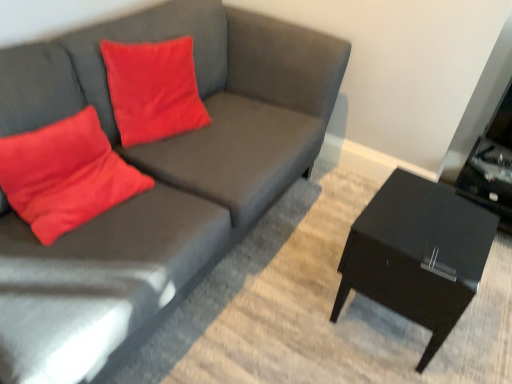
Image resolution: width=512 pixels, height=384 pixels. What do you see at coordinates (65, 175) in the screenshot? I see `matte red pillow at left` at bounding box center [65, 175].

I want to click on black glossy side table at right, so click(417, 254).

Where is `matte gray couch at center`? The image size is (512, 384). matte gray couch at center is located at coordinates (155, 177).

From the image's perspective, does matte red pillow at left appear higher than black glossy side table at right?

Indeed, from the image's perspective, matte red pillow at left is shown above black glossy side table at right.

How different are the orientations of matte red pillow at left and black glossy side table at right in degrees?

The angle between the facing direction of matte red pillow at left and the facing direction of black glossy side table at right is 85 degrees.

Is matte red pillow at left positioned with its back to black glossy side table at right?

No, matte red pillow at left is not facing the opposite direction of black glossy side table at right.

From a real-world perspective, is matte red pillow at left physically above black glossy side table at right?

Yes.

Between point (484, 254) and point (63, 69), which one is positioned in front?

The point (63, 69) is more forward.

Is black glossy side table at right far away from matte gray couch at center?

That's right, there is a large distance between black glossy side table at right and matte gray couch at center.

What are the coordinates of `table below the matte gray couch at center (from a real-world perspective)` in the screenshot? It's located at (417, 254).

Can you confirm if matte gray couch at center is smaller than black glossy side table at right?

No, matte gray couch at center is not smaller than black glossy side table at right.

Is matte gray couch at center inside the boundaries of black glossy side table at right, or outside?

matte gray couch at center is not inside black glossy side table at right, it's outside.

At what (x,y) coordinates should I click in order to perform the action: click on table located behind the matte gray couch at center. Please return your answer as a coordinate pair (x, y). Looking at the image, I should click on (417, 254).

Is the position of matte red pillow at left more distant than that of matte gray couch at center?

Yes, matte red pillow at left is further from the viewer.

Identify the location of throw pillow positioned vertically above the matte gray couch at center (from a real-world perspective). (65, 175).

How many degrees apart are the facing directions of matte red pillow at left and matte gray couch at center?

5.33 degrees.

From the image's perspective, which one is positioned lower, matte red pillow at left or matte gray couch at center?

matte red pillow at left, from the image's perspective.

Considering the relative sizes of black glossy side table at right and matte red pillow at left in the image provided, is black glossy side table at right wider than matte red pillow at left?

Yes, black glossy side table at right is wider than matte red pillow at left.

From their relative heights in the image, would you say black glossy side table at right is taller or shorter than matte red pillow at left?

Clearly, black glossy side table at right is shorter compared to matte red pillow at left.

Locate an element on the screen. The image size is (512, 384). table on the right of matte red pillow at left is located at coordinates (417, 254).

Which object is closer to the camera, black glossy side table at right or matte red pillow at left?

matte red pillow at left is closer to the camera.

Does matte gray couch at center have a greater width compared to matte red pillow at left?

Yes.

Does matte gray couch at center turn towards matte red pillow at left?

Yes, matte gray couch at center faces towards matte red pillow at left.

I want to click on throw pillow that is above the black glossy side table at right (from a real-world perspective), so click(65, 175).

The image size is (512, 384). In order to click on table behind the matte gray couch at center in this screenshot , I will do `click(417, 254)`.

In the scene shown: When comparing their distances from matte red pillow at left, does matte gray couch at center or black glossy side table at right seem further?

black glossy side table at right lies further to matte red pillow at left than the other object.

From the image, which object appears to be nearer to matte gray couch at center, matte red pillow at left or black glossy side table at right?

Among the two, matte red pillow at left is located nearer to matte gray couch at center.

From the picture: When comparing their distances from black glossy side table at right, does matte gray couch at center or matte red pillow at left seem further?

matte red pillow at left is positioned further to the anchor black glossy side table at right.

From the picture: Considering their positions, is matte red pillow at left positioned further to black glossy side table at right than matte gray couch at center?

matte red pillow at left lies further to black glossy side table at right than the other object.

Looking at the image, which one is located closer to matte gray couch at center, black glossy side table at right or matte red pillow at left?

matte red pillow at left.

Considering their positions, is black glossy side table at right positioned closer to matte red pillow at left than matte gray couch at center?

The object closer to matte red pillow at left is matte gray couch at center.

Find the location of `studio couch between matte red pillow at left and black glossy side table at right`. studio couch between matte red pillow at left and black glossy side table at right is located at coordinates (155, 177).